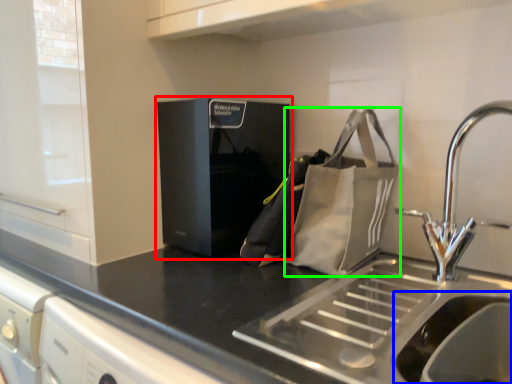
Question: Which object is positioned closest to home appliance (highlighted by a red box)? Select from sink (highlighted by a blue box) and pouch (highlighted by a green box).

Choices:
 (A) sink
 (B) pouch

Answer: (B)